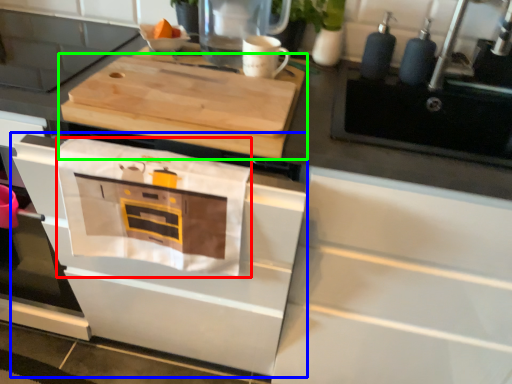
Question: Considering the real-world distances, which object is farthest from cloth (highlighted by a red box)? oven (highlighted by a blue box) or cutting board (highlighted by a green box)?

Choices:
 (A) oven
 (B) cutting board

Answer: (B)